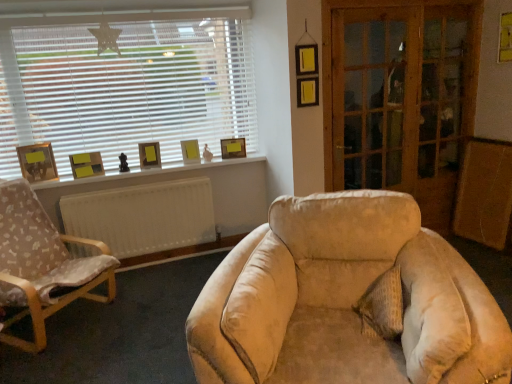
Question: Considering the relative sizes of wooden screen door at right, acting as the second screen door starting from the left, and yellow paper at upper right in the image provided, is wooden screen door at right, acting as the second screen door starting from the left, smaller than yellow paper at upper right?

Choices:
 (A) yes
 (B) no

Answer: (B)

Question: From the image's perspective, does wooden screen door at right, placed as the 1th screen door when sorted from right to left, appear lower than yellow paper at upper right?

Choices:
 (A) yes
 (B) no

Answer: (A)

Question: Is wooden screen door at right, placed as the 1th screen door when sorted from right to left, looking in the opposite direction of yellow paper at upper right?

Choices:
 (A) yes
 (B) no

Answer: (B)

Question: Is wooden screen door at right, placed as the 1th screen door when sorted from right to left, positioned far away from yellow paper at upper right?

Choices:
 (A) no
 (B) yes

Answer: (A)

Question: Is wooden screen door at right, placed as the 1th screen door when sorted from right to left, facing towards yellow paper at upper right?

Choices:
 (A) no
 (B) yes

Answer: (B)

Question: Considering the relative positions of matte wooden picture frame at left, the first picture frame when ordered from left to right, and yellow matte picture frame at upper center, marked as the fifth picture frame in a left-to-right arrangement, in the image provided, is matte wooden picture frame at left, the first picture frame when ordered from left to right, to the left or to the right of yellow matte picture frame at upper center, marked as the fifth picture frame in a left-to-right arrangement,?

Choices:
 (A) right
 (B) left

Answer: (B)

Question: From a real-world perspective, is matte wooden picture frame at left, the first picture frame when ordered from left to right, physically located above or below yellow matte picture frame at upper center, which is counted as the first picture frame, starting from the right?

Choices:
 (A) above
 (B) below

Answer: (A)

Question: In the image, is matte wooden picture frame at left, the fifth picture frame from the right, positioned in front of or behind yellow matte picture frame at upper center, which is counted as the first picture frame, starting from the right?

Choices:
 (A) front
 (B) behind

Answer: (A)

Question: Would you say matte wooden picture frame at left, the first picture frame when ordered from left to right, is inside or outside yellow matte picture frame at upper center, which is counted as the first picture frame, starting from the right?

Choices:
 (A) inside
 (B) outside

Answer: (B)

Question: Is wooden chair with fabric cushion at left inside or outside of matte yellow picture frame at center, which ranks as the second picture frame in right-to-left order?

Choices:
 (A) outside
 (B) inside

Answer: (A)

Question: Is wooden chair with fabric cushion at left to the left or to the right of matte yellow picture frame at center, which is the 4th picture frame in left-to-right order, in the image?

Choices:
 (A) right
 (B) left

Answer: (B)

Question: Is wooden chair with fabric cushion at left in front of or behind matte yellow picture frame at center, which ranks as the second picture frame in right-to-left order, in the image?

Choices:
 (A) behind
 (B) front

Answer: (B)

Question: Looking at their shapes, would you say wooden chair with fabric cushion at left is wider or thinner than matte yellow picture frame at center, which is the 4th picture frame in left-to-right order?

Choices:
 (A) thin
 (B) wide

Answer: (B)

Question: Is point (347, 168) positioned closer to the camera than point (224, 142)?

Choices:
 (A) farther
 (B) closer

Answer: (B)

Question: Looking at the image, does wooden glass screen door at right, which appears as the 1th screen door when viewed from the left, seem bigger or smaller compared to yellow matte picture frame at upper center, which is counted as the first picture frame, starting from the right?

Choices:
 (A) big
 (B) small

Answer: (A)